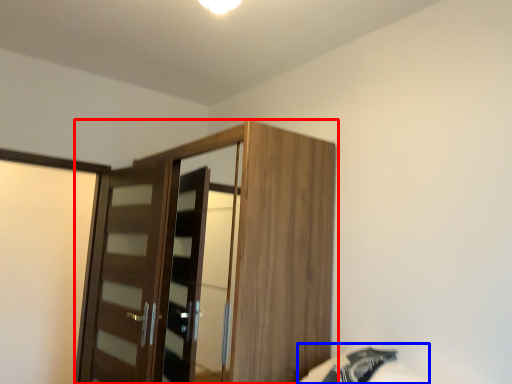
Question: Which object appears farthest to the camera in this image, cupboard (highlighted by a red box) or bed (highlighted by a blue box)?

Choices:
 (A) cupboard
 (B) bed

Answer: (A)